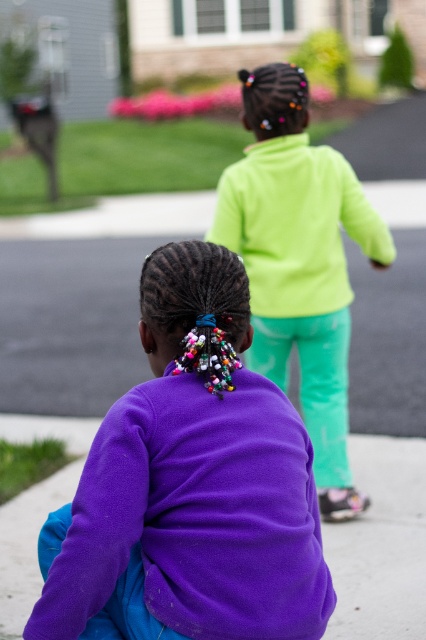
You are a photographer trying to capture both the purple fleece jacket at lower left and the neon green fleece at upper center in a single frame. Based on their positions, which one will appear larger in your photo?

The purple fleece jacket at lower left will appear larger in the photo because it is closer to the viewer than the neon green fleece at upper center.

You are a photographer trying to capture the purple fleece jacket at lower left in the image. According to the coordinates provided, where should you focus your camera to ensure the jacket is centered in the frame?

To center the purple fleece jacket at lower left in the frame, focus the camera at the coordinates point (195, 481) since that is where the jacket is located.